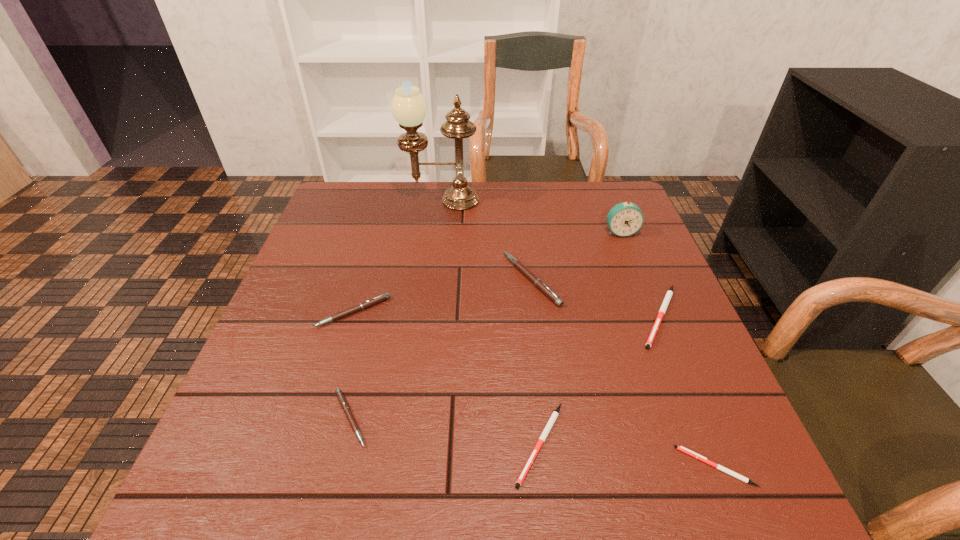
Where is `pink pen identified as the second closest to the second smallest white pen`? The height and width of the screenshot is (540, 960). pink pen identified as the second closest to the second smallest white pen is located at coordinates (341, 398).

What are the coordinates of `white pen that stands as the closest to the tallest object` in the screenshot? It's located at (669, 293).

Identify the location of white pen that stands as the closest to the smallest white pen. The image size is (960, 540). (555, 414).

I want to click on blank area in the image that satisfies the following two spatial constraints: 1. on the clicker of the biggest white pen; 2. on the clicker of the shortest object, so click(x=722, y=467).

I want to click on free space that satisfies the following two spatial constraints: 1. on the front-facing side of the blue alarm clock; 2. at the nib of the tallest pen, so click(639, 280).

At what (x,y) coordinates should I click in order to perform the action: click on blank area in the image that satisfies the following two spatial constraints: 1. on the front-facing side of the second farthest object; 2. at the nib of the biggest pink pen. Please return your answer as a coordinate pair (x, y). The width and height of the screenshot is (960, 540). Looking at the image, I should click on (639, 280).